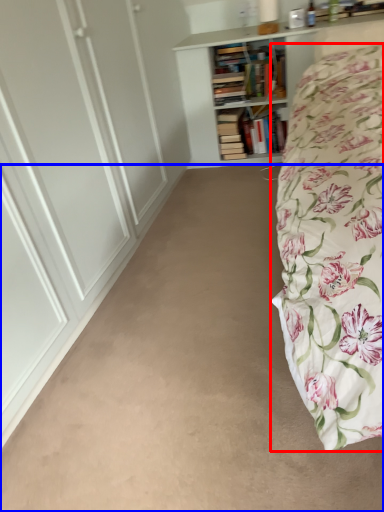
Question: Which object is further to the camera taking this photo, bed (highlighted by a red box) or plain (highlighted by a blue box)?

Choices:
 (A) bed
 (B) plain

Answer: (B)